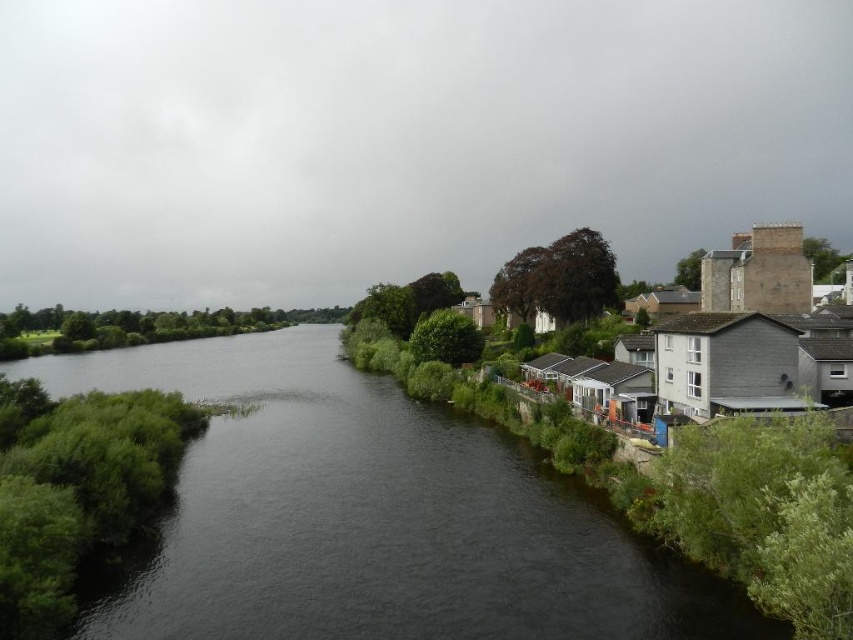
Is dark water at center thinner than gray stone houses at right?

No.

Is dark water at center to the right of gray stone houses at right from the viewer's perspective?

No, dark water at center is not to the right of gray stone houses at right.

Find the location of a particular element. dark water at center is located at coordinates (372, 516).